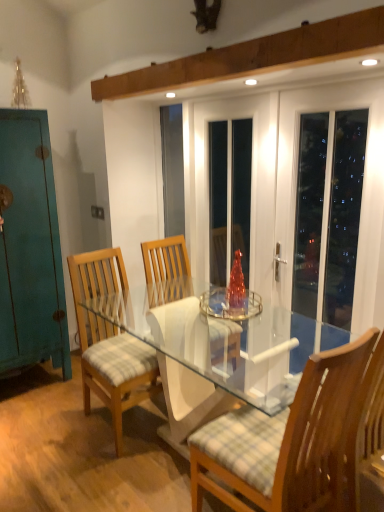
Question: From their relative heights in the image, would you say wooden chair with checkered cushion at center, placed as the second chair when sorted from left to right, is taller or shorter than teal matte cabinet at left?

Choices:
 (A) tall
 (B) short

Answer: (B)

Question: From a real-world perspective, is wooden chair with checkered cushion at center, marked as the second chair in a back-to-front arrangement, physically located above or below teal matte cabinet at left?

Choices:
 (A) above
 (B) below

Answer: (B)

Question: Estimate the real-world distances between objects in this image. Which object is farther from the teal matte cabinet at left?

Choices:
 (A) white glossy door at upper right
 (B) wooden chair with checkered cushion at center, placed as the second chair when sorted from left to right
 (C) light brown wood chair at center, the second chair viewed from the right

Answer: (B)

Question: Which object is the closest to the light brown wood chair at center, which is the 1th chair from left to right?

Choices:
 (A) teal matte cabinet at left
 (B) wooden chair with checkered cushion at center, which is the first chair in right-to-left order
 (C) white glossy door at upper right

Answer: (A)